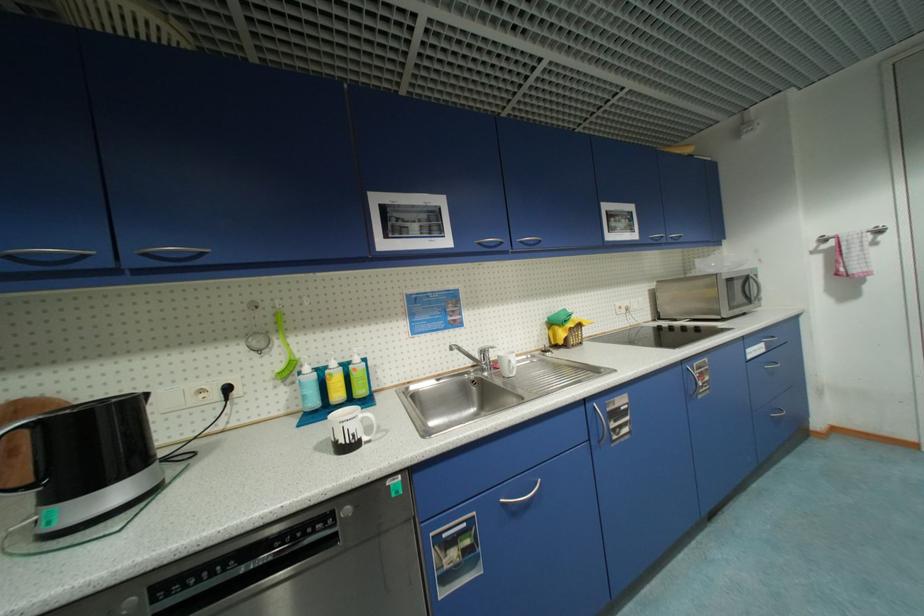
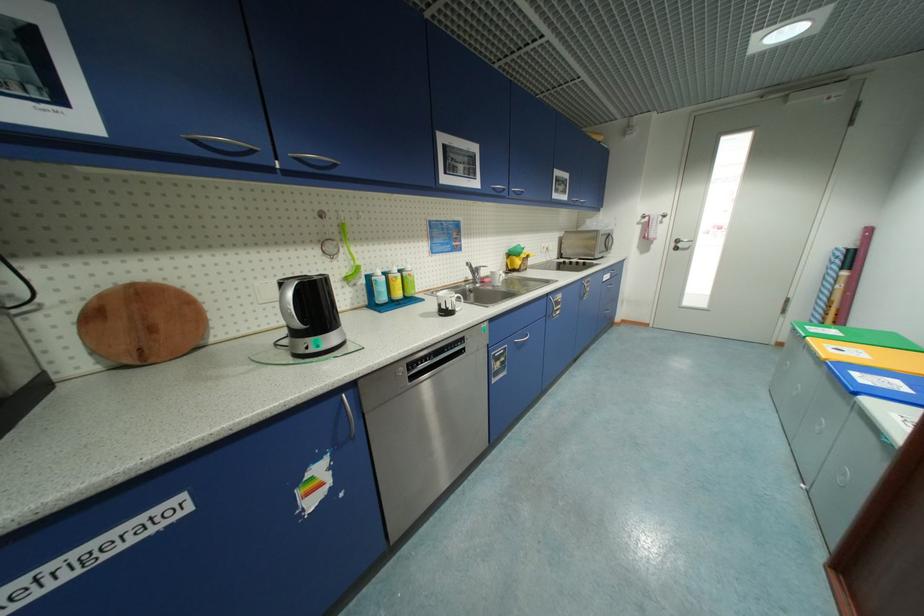
In the second image, find the point that corresponds to point (485, 245) in the first image.

(499, 190)